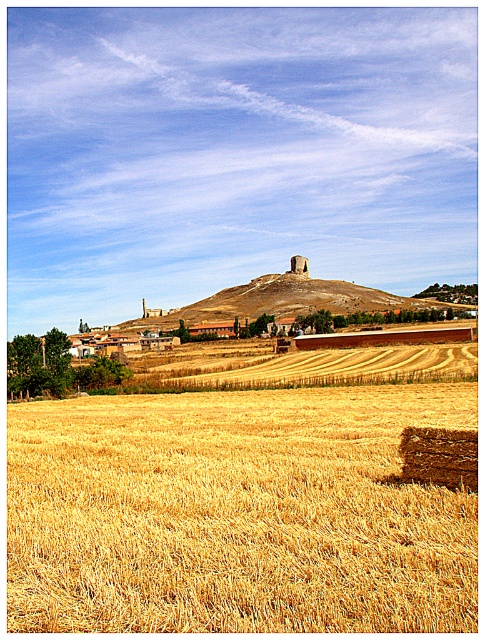
You are a farmer standing at the edge of the harvested fields and looking towards the golden straw bale at lower right and the smooth beige hill at center. Which object is taller?

The golden straw bale at lower right is not as tall as the smooth beige hill at center, so the smooth beige hill at center is taller.

You are a farmer who wants to move a golden straw bale at center to the smooth beige hill at center for a project. Given that your tractor can carry the bale but has a maximum range of 100 meters before needing to refuel, do you need to refuel before reaching the hill?

The golden straw bale at center and smooth beige hill at center are 120.30 meters apart. Since the tractor can only go 100 meters before needing to refuel, you will need to refuel before reaching the hill.

Looking at this image, you are a farmer who wants to move a golden straw bale from the center to the lower right corner of the field. Considering the space available, will the golden straw bale at center fit in the spot currently occupied by the golden straw bale at lower right?

The golden straw bale at lower right is smaller in width than the golden straw bale at center. Therefore, the golden straw bale at center may not fit in the spot currently occupied by the golden straw bale at lower right due to its larger width.